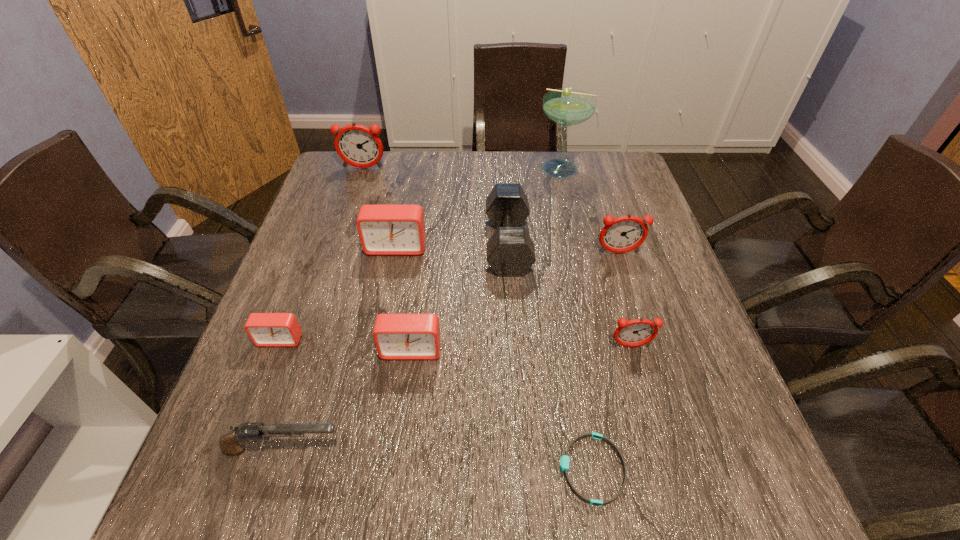
This screenshot has width=960, height=540. In order to click on martini that is at the right edge in this screenshot , I will do click(x=566, y=106).

This screenshot has height=540, width=960. What are the coordinates of `object that is at the far left corner` in the screenshot? It's located at (358, 146).

Locate an element on the screen. The image size is (960, 540). object positioned at the far right corner is located at coordinates (566, 106).

I want to click on vacant area at the far edge of the desktop, so click(x=417, y=191).

Identify the location of free space at the near edge of the desktop. (308, 500).

In the image, there is a desktop. Identify the location of vacant space at the left edge. The width and height of the screenshot is (960, 540). (283, 284).

Where is `vacant space at the right edge`? This screenshot has height=540, width=960. vacant space at the right edge is located at coordinates (628, 199).

This screenshot has height=540, width=960. What are the coordinates of `vacant point at the far left corner` in the screenshot? It's located at (362, 183).

Find the location of `vacant region between the shortest alarm clock and the second farthest reddish-pink alarm clock`. vacant region between the shortest alarm clock and the second farthest reddish-pink alarm clock is located at coordinates (449, 296).

The height and width of the screenshot is (540, 960). I want to click on vacant area between the gray wristband and the second smallest red alarm clock, so click(501, 409).